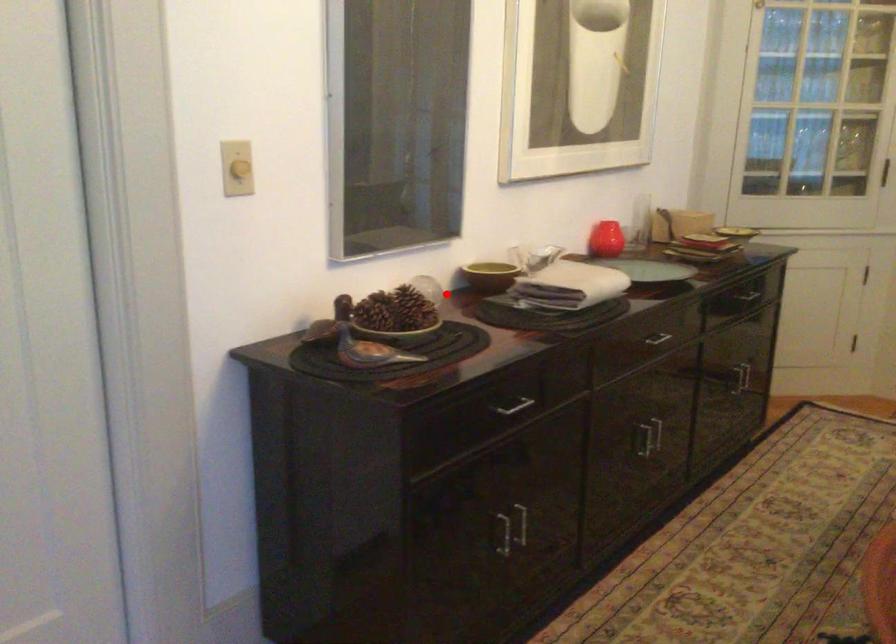
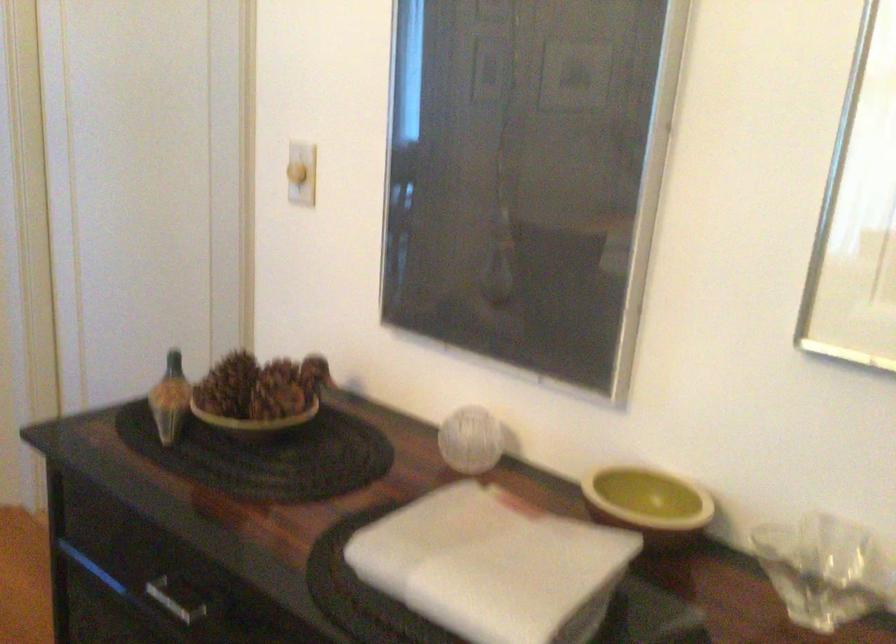
Question: I am providing you with two images of the same scene from different viewpoints. Given a red point in image1, look at the same physical point in image2. Is it:

Choices:
 (A) Closer to the viewpoint
 (B) Farther from the viewpoint

Answer: (A)